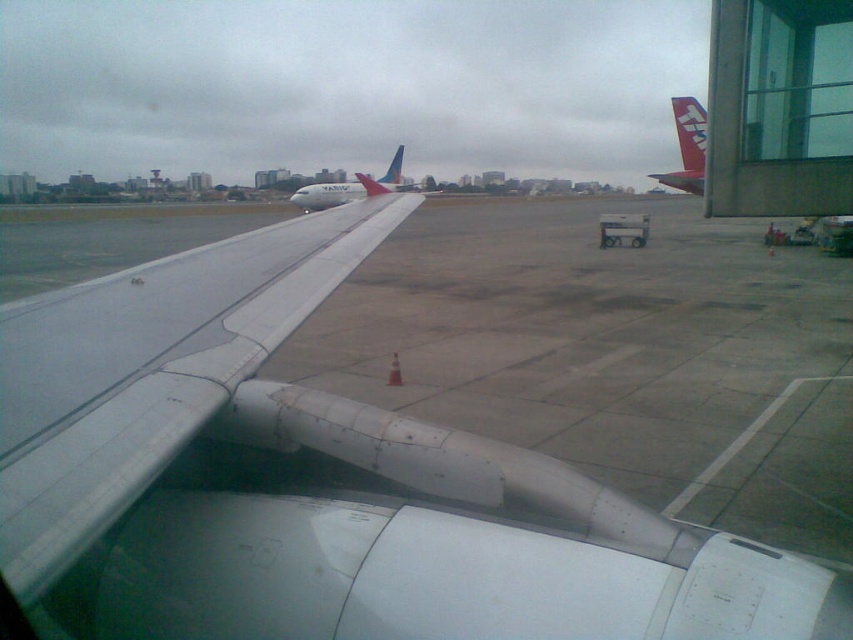
You are a flight attendant standing inside the aircraft. You look out the window and see the metallic gray wing at center and the white glossy airplane at center. Which object is taller?

The metallic gray wing at center is not as tall as the white glossy airplane at center, so the white glossy airplane at center is taller.